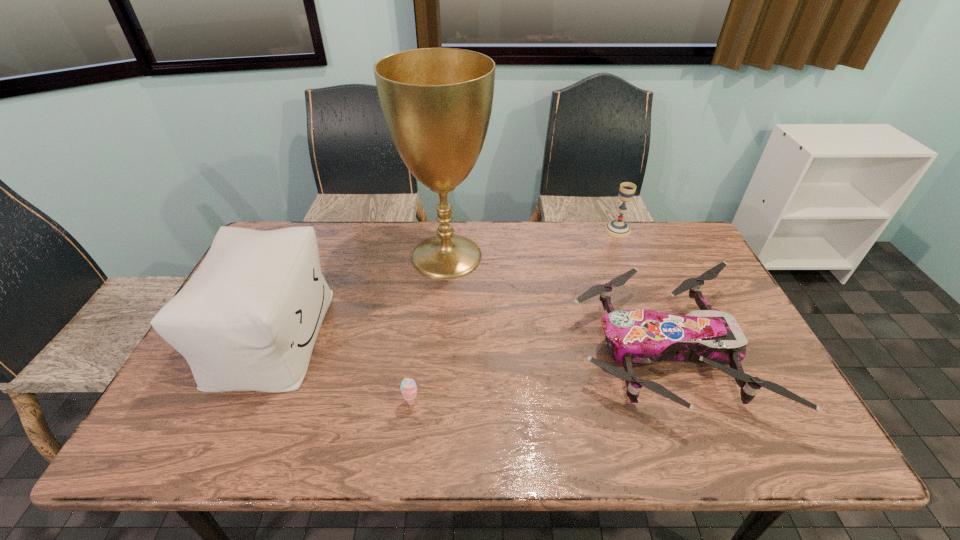
Locate an element on the screen. free space located 0.340m on the front-facing side of the radio receiver is located at coordinates click(x=562, y=316).

Locate an element on the screen. Image resolution: width=960 pixels, height=540 pixels. vacant region located on the front-facing side of the radio receiver is located at coordinates (626, 316).

The height and width of the screenshot is (540, 960). Identify the location of vacant area situated 0.050m on the front-facing side of the radio receiver. [x=671, y=316].

The height and width of the screenshot is (540, 960). I want to click on vacant space located 0.320m on the back of the shortest object, so click(x=284, y=257).

Identify the location of object that is at the near edge. This screenshot has width=960, height=540. (202, 365).

Find the location of `detergent that is positioned at the left edge`. detergent that is positioned at the left edge is located at coordinates (245, 199).

Identify the location of pottery present at the left edge. This screenshot has width=960, height=540. (202, 365).

The width and height of the screenshot is (960, 540). What are the coordinates of `detergent that is at the right edge` in the screenshot? It's located at (685, 172).

What are the coordinates of `radio receiver that is positioned at the right edge` in the screenshot? It's located at (756, 312).

The height and width of the screenshot is (540, 960). What are the coordinates of `object at the near left corner` in the screenshot? It's located at (202, 365).